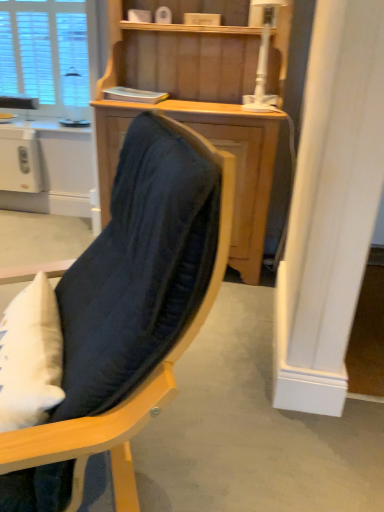
Question: Is white plastic lamp at upper center spatially inside white plastic toaster at left, or outside of it?

Choices:
 (A) outside
 (B) inside

Answer: (A)

Question: In terms of height, does white plastic lamp at upper center look taller or shorter compared to white plastic toaster at left?

Choices:
 (A) short
 (B) tall

Answer: (B)

Question: Estimate the real-world distances between objects in this image. Which object is farther from the velvet dark blue chair at center?

Choices:
 (A) wooden cabinet at center
 (B) white plastic toaster at left
 (C) white plastic lamp at upper center
 (D) white textured window at upper left

Answer: (D)

Question: Considering the real-world distances, which object is closest to the wooden cabinet at center?

Choices:
 (A) white plastic lamp at upper center
 (B) white textured window at upper left
 (C) velvet dark blue chair at center
 (D) white plastic toaster at left

Answer: (A)